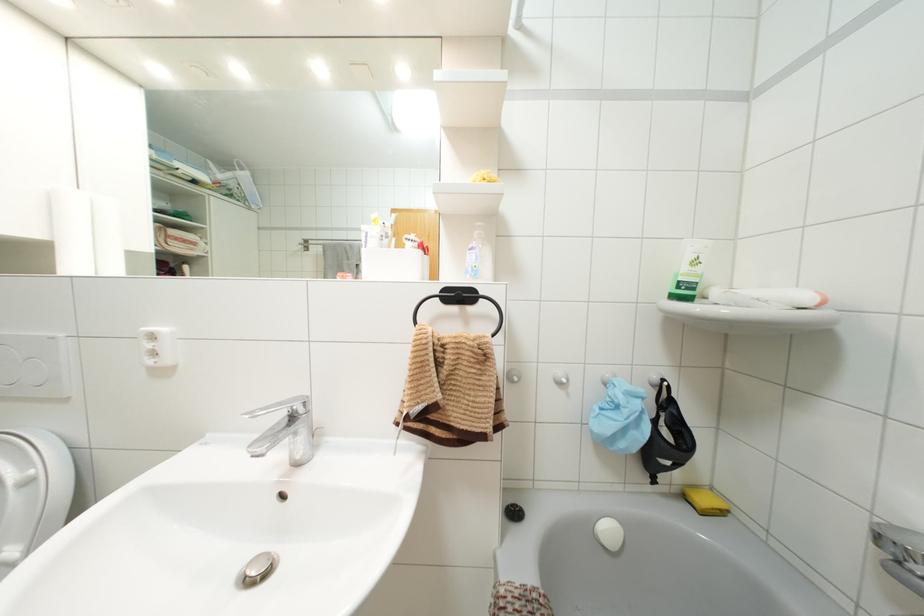
Find the location of a particular element. Image resolution: width=924 pixels, height=616 pixels. large flush button is located at coordinates (8, 366).